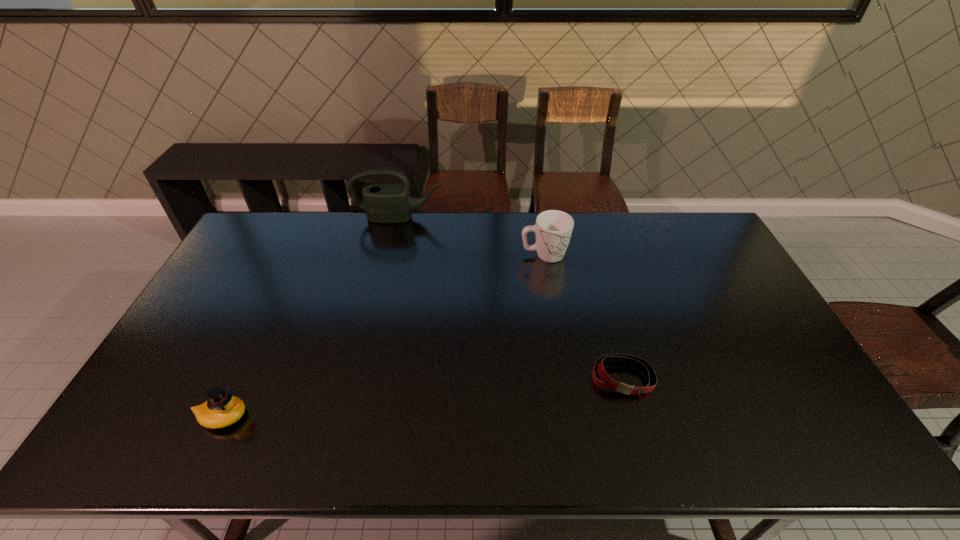
Identify the location of vacant space located on the front-facing side of the leftmost object. (379, 417).

Where is `vacant region located on the front of the dog collar`? The width and height of the screenshot is (960, 540). vacant region located on the front of the dog collar is located at coordinates (634, 418).

Where is `watering can at the far edge`? The image size is (960, 540). watering can at the far edge is located at coordinates [x=384, y=203].

Identify the location of mug present at the far edge. (553, 228).

The height and width of the screenshot is (540, 960). I want to click on object present at the near edge, so click(x=222, y=409).

In the image, there is a desktop. Identify the location of vacant space at the far edge. The image size is (960, 540). (653, 232).

Find the location of a particular element. This screenshot has width=960, height=540. free region at the near edge of the desktop is located at coordinates (540, 433).

This screenshot has height=540, width=960. In the image, there is a desktop. In order to click on blank space at the left edge in this screenshot , I will do `click(201, 389)`.

Image resolution: width=960 pixels, height=540 pixels. What are the coordinates of `free space at the right edge of the desktop` in the screenshot? It's located at (826, 422).

The image size is (960, 540). Identify the location of free space between the tallest object and the third farthest object. (511, 298).